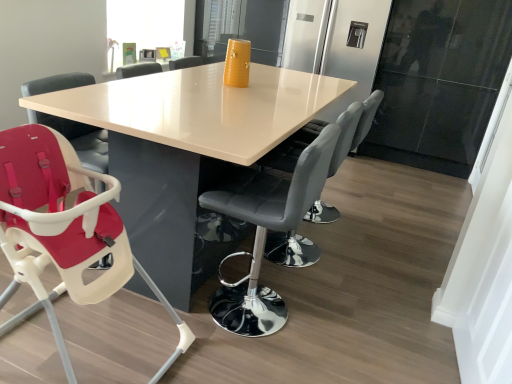
Question: Would you say matte white highchair at lower left, positioned as the 1th chair in left-to-right order, is outside matte black chair at center, which is counted as the 1th chair, starting from the right?

Choices:
 (A) yes
 (B) no

Answer: (A)

Question: Is matte white highchair at lower left, positioned as the 1th chair in left-to-right order, further to the viewer compared to matte black chair at center, which is counted as the 1th chair, starting from the right?

Choices:
 (A) yes
 (B) no

Answer: (B)

Question: Could you tell me if matte white highchair at lower left, positioned as the third chair in right-to-left order, is facing matte black chair at center, placed as the third chair when sorted from left to right?

Choices:
 (A) yes
 (B) no

Answer: (B)

Question: Is matte white highchair at lower left, positioned as the 1th chair in left-to-right order, to the right of matte black chair at center, which is counted as the 1th chair, starting from the right, from the viewer's perspective?

Choices:
 (A) no
 (B) yes

Answer: (A)

Question: Is matte white highchair at lower left, positioned as the third chair in right-to-left order, closer to the viewer compared to matte black chair at center, which is counted as the 1th chair, starting from the right?

Choices:
 (A) no
 (B) yes

Answer: (B)

Question: From a real-world perspective, is matte white highchair at lower left, positioned as the third chair in right-to-left order, positioned under matte black chair at center, which is counted as the 1th chair, starting from the right, based on gravity?

Choices:
 (A) no
 (B) yes

Answer: (B)

Question: Is matte black chair at center, which is counted as the 1th chair, starting from the right, directly adjacent to black leather bar stool at center, the 2th chair viewed from the right?

Choices:
 (A) no
 (B) yes

Answer: (A)

Question: Could you tell me if matte black chair at center, which is counted as the 1th chair, starting from the right, is facing black leather bar stool at center, the 2th chair viewed from the right?

Choices:
 (A) yes
 (B) no

Answer: (B)

Question: Can you confirm if matte black chair at center, placed as the third chair when sorted from left to right, is shorter than black leather bar stool at center, which is the second chair in left-to-right order?

Choices:
 (A) yes
 (B) no

Answer: (B)

Question: Is matte black chair at center, which is counted as the 1th chair, starting from the right, at the left side of black leather bar stool at center, which is the second chair in left-to-right order?

Choices:
 (A) no
 (B) yes

Answer: (A)

Question: Is matte black chair at center, which is counted as the 1th chair, starting from the right, behind black leather bar stool at center, the 2th chair viewed from the right?

Choices:
 (A) no
 (B) yes

Answer: (B)

Question: From the image's perspective, does matte black chair at center, placed as the third chair when sorted from left to right, appear higher than black leather bar stool at center, the 2th chair viewed from the right?

Choices:
 (A) no
 (B) yes

Answer: (B)

Question: Is matte white highchair at lower left, positioned as the third chair in right-to-left order, to the right of black leather bar stool at center, which is the second chair in left-to-right order, from the viewer's perspective?

Choices:
 (A) no
 (B) yes

Answer: (A)